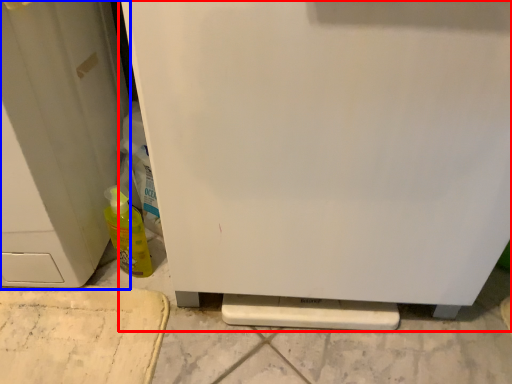
Question: Which object appears farthest to the camera in this image, refrigerator (highlighted by a red box) or door (highlighted by a blue box)?

Choices:
 (A) refrigerator
 (B) door

Answer: (B)